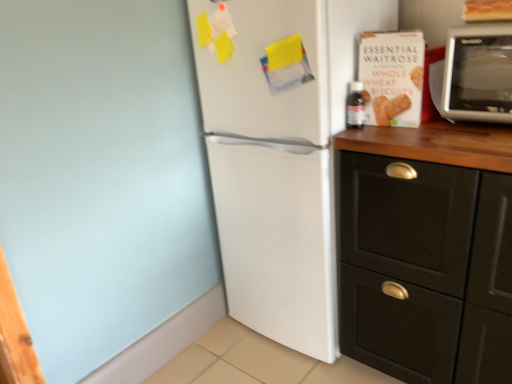
Question: Is white matte refrigerator at center at the back of silver metallic microwave at upper right?

Choices:
 (A) no
 (B) yes

Answer: (A)

Question: Considering the relative sizes of silver metallic microwave at upper right and white matte refrigerator at center in the image provided, is silver metallic microwave at upper right smaller than white matte refrigerator at center?

Choices:
 (A) yes
 (B) no

Answer: (A)

Question: Can we say silver metallic microwave at upper right lies outside white matte refrigerator at center?

Choices:
 (A) no
 (B) yes

Answer: (B)

Question: Is silver metallic microwave at upper right thinner than white matte refrigerator at center?

Choices:
 (A) no
 (B) yes

Answer: (B)

Question: Is silver metallic microwave at upper right positioned behind white matte refrigerator at center?

Choices:
 (A) no
 (B) yes

Answer: (A)

Question: Does silver metallic microwave at upper right turn towards white matte refrigerator at center?

Choices:
 (A) yes
 (B) no

Answer: (B)

Question: Is the depth of black matte cabinet at right less than that of white cardboard box of whole wheat biscuits at upper right?

Choices:
 (A) no
 (B) yes

Answer: (B)

Question: Can you confirm if black matte cabinet at right is positioned to the right of white cardboard box of whole wheat biscuits at upper right?

Choices:
 (A) no
 (B) yes

Answer: (B)

Question: Considering the relative positions of black matte cabinet at right and white cardboard box of whole wheat biscuits at upper right in the image provided, is black matte cabinet at right behind white cardboard box of whole wheat biscuits at upper right?

Choices:
 (A) no
 (B) yes

Answer: (A)

Question: Can you confirm if black matte cabinet at right is positioned to the left of white cardboard box of whole wheat biscuits at upper right?

Choices:
 (A) no
 (B) yes

Answer: (A)

Question: Could you tell me if black matte cabinet at right is facing white cardboard box of whole wheat biscuits at upper right?

Choices:
 (A) yes
 (B) no

Answer: (B)

Question: Is black matte cabinet at right looking in the opposite direction of white cardboard box of whole wheat biscuits at upper right?

Choices:
 (A) no
 (B) yes

Answer: (A)

Question: Does white cardboard box of whole wheat biscuits at upper right have a greater width compared to white matte refrigerator at center?

Choices:
 (A) yes
 (B) no

Answer: (B)